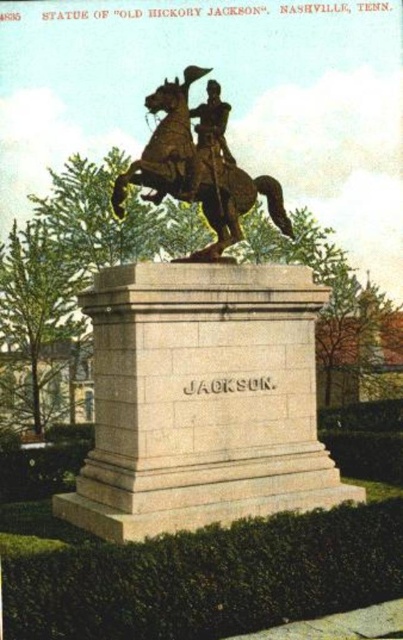
Is gold polished statue at center smaller than bronze statue at center?

No.

Can you confirm if gold polished statue at center is positioned to the left of bronze statue at center?

Yes, gold polished statue at center is to the left of bronze statue at center.

Is point (97, 532) in front of point (209, 81)?

That is True.

Locate an element on the screen. Image resolution: width=403 pixels, height=640 pixels. gold polished statue at center is located at coordinates (201, 362).

Between gold polished metal horse at center and bronze statue at center, which one is positioned higher?

bronze statue at center

Which is in front, point (193, 168) or point (203, 132)?

Point (193, 168) is in front.

Between point (176, 97) and point (213, 109), which one is positioned in front?

Point (176, 97) is in front.

At what (x,y) coordinates should I click in order to perform the action: click on gold polished metal horse at center. Please return your answer as a coordinate pair (x, y). This screenshot has width=403, height=640. Looking at the image, I should click on (199, 164).

Image resolution: width=403 pixels, height=640 pixels. What do you see at coordinates (201, 362) in the screenshot? I see `gold polished statue at center` at bounding box center [201, 362].

How much distance is there between gold polished statue at center and gold polished metal horse at center?

gold polished statue at center and gold polished metal horse at center are 5.84 feet apart.

This screenshot has width=403, height=640. Find the location of `gold polished statue at center`. gold polished statue at center is located at coordinates (201, 362).